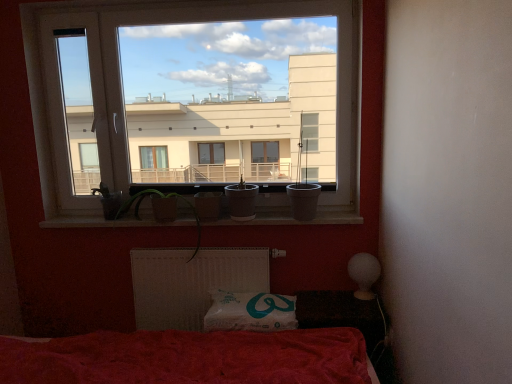
What is the approximate width of transparent glass window at upper center?

It is 3.83 inches.

The image size is (512, 384). What do you see at coordinates (158, 203) in the screenshot?
I see `green matte plant at center` at bounding box center [158, 203].

Describe the element at coordinates (290, 219) in the screenshot. I see `smooth concrete window sill at center` at that location.

Where is `white textured radiator at lower center`? white textured radiator at lower center is located at coordinates (191, 282).

The width and height of the screenshot is (512, 384). What do you see at coordinates (191, 283) in the screenshot?
I see `red fabric bed at lower left` at bounding box center [191, 283].

What do you see at coordinates (250, 312) in the screenshot?
I see `white fabric pillow at lower center` at bounding box center [250, 312].

Identify the location of matte white pot at center. The image size is (512, 384). (241, 200).

Is smooth concrete window sill at center oriented away from transparent glass window at upper center?

smooth concrete window sill at center is not turned away from transparent glass window at upper center.

Is transparent glass window at upper center located within smooth concrete window sill at center?

No, transparent glass window at upper center is not inside smooth concrete window sill at center.

Is smooth concrete window sill at center closer to camera compared to transparent glass window at upper center?

No, it is not.

Which object is wider, smooth concrete window sill at center or transparent glass window at upper center?

With larger width is smooth concrete window sill at center.

Is matte white pot at center in front of or behind smooth concrete window sill at center in the image?

matte white pot at center is positioned closer to the viewer than smooth concrete window sill at center.

From a real-world perspective, between matte white pot at center and smooth concrete window sill at center, who is vertically lower?

smooth concrete window sill at center, from a real-world perspective.

From the image's perspective, which one is positioned higher, matte white pot at center or smooth concrete window sill at center?

matte white pot at center.

Consider the image. Does matte white pot at center turn towards smooth concrete window sill at center?

No, matte white pot at center is not oriented towards smooth concrete window sill at center.

Does matte white pot at center appear on the right side of transparent glass window at upper center?

Correct, you'll find matte white pot at center to the right of transparent glass window at upper center.

Does matte white pot at center have a greater width compared to transparent glass window at upper center?

Yes.

Find the location of a particular element. window above the matte white pot at center (from a real-world perspective) is located at coordinates (194, 99).

Is matte white pot at center positioned far away from transparent glass window at upper center?

Actually, matte white pot at center and transparent glass window at upper center are a little close together.

Are red fabric bed at lower left and green matte plant at center far apart?

No.

Is red fabric bed at lower left facing away from green matte plant at center?

No, red fabric bed at lower left's orientation is not away from green matte plant at center.

Is red fabric bed at lower left not inside green matte plant at center?

Indeed, red fabric bed at lower left is completely outside green matte plant at center.

Is red fabric bed at lower left in front of green matte plant at center?

Yes, the depth of red fabric bed at lower left is less than that of green matte plant at center.

Can you confirm if transparent glass window at upper center is shorter than matte white pot at center?

In fact, transparent glass window at upper center may be taller than matte white pot at center.

Is transparent glass window at upper center wider than matte white pot at center?

No.

In the image, is transparent glass window at upper center positioned in front of or behind matte white pot at center?

Clearly, transparent glass window at upper center is in front of matte white pot at center.

How different are the orientations of transparent glass window at upper center and matte white pot at center in degrees?

transparent glass window at upper center and matte white pot at center are facing 1.37 degrees away from each other.

From the image's perspective, would you say white textured radiator at lower center is positioned over white fabric pillow at lower center?

Yes, from the image's perspective, white textured radiator at lower center is on top of white fabric pillow at lower center.

Which is in front, white textured radiator at lower center or white fabric pillow at lower center?

white fabric pillow at lower center.

Where is `radiator behind the white fabric pillow at lower center`? radiator behind the white fabric pillow at lower center is located at coordinates (191, 282).

Is white textured radiator at lower center inside the boundaries of white fabric pillow at lower center, or outside?

white textured radiator at lower center is not enclosed by white fabric pillow at lower center.

Which of these two, smooth concrete window sill at center or white fabric pillow at lower center, is bigger?

white fabric pillow at lower center.

Is smooth concrete window sill at center taller than white fabric pillow at lower center?

Incorrect, the height of smooth concrete window sill at center is not larger of that of white fabric pillow at lower center.

Does point (210, 225) come closer to viewer compared to point (223, 319)?

No, it is behind (223, 319).

Is smooth concrete window sill at center placed right next to white fabric pillow at lower center?

They are not placed beside each other.

At what (x,y) coordinates should I click in order to perform the action: click on window sill below the transparent glass window at upper center (from a real-world perspective). Please return your answer as a coordinate pair (x, y). This screenshot has width=512, height=384. Looking at the image, I should click on (290, 219).

I want to click on window sill below the matte white pot at center (from the image's perspective), so click(x=290, y=219).

Which object lies further to the anchor point smooth concrete window sill at center, red fabric bed at lower left or green matte plant at center?

red fabric bed at lower left lies further to smooth concrete window sill at center than the other object.

Considering their positions, is white textured radiator at lower center positioned further to smooth concrete window sill at center than green matte plant at center?

white textured radiator at lower center.

Estimate the real-world distances between objects in this image. Which object is closer to green matte plant at center, red fabric bed at lower left or white textured radiator at lower center?

white textured radiator at lower center lies closer to green matte plant at center than the other object.

Based on their spatial positions, is white fabric pillow at lower center or transparent glass window at upper center further from green matte plant at center?

transparent glass window at upper center is positioned further to the anchor green matte plant at center.

Looking at the image, which one is located further to smooth concrete window sill at center, green matte plant at center or white fabric pillow at lower center?

white fabric pillow at lower center is positioned further to the anchor smooth concrete window sill at center.

Which object lies further to the anchor point red fabric bed at lower left, white fabric pillow at lower center or white textured radiator at lower center?

Based on the image, white fabric pillow at lower center appears to be further to red fabric bed at lower left.

From the image, which object appears to be farther from transparent glass window at upper center, white textured radiator at lower center or white fabric pillow at lower center?

The object further to transparent glass window at upper center is white fabric pillow at lower center.

Based on the photo, when comparing their distances from smooth concrete window sill at center, does red fabric bed at lower left or white textured radiator at lower center seem closer?

red fabric bed at lower left is closer to smooth concrete window sill at center.

The image size is (512, 384). In order to click on plant that lies between smooth concrete window sill at center and white fabric pillow at lower center from top to bottom in this screenshot , I will do `click(158, 203)`.

Find the location of a particular element. window sill between transparent glass window at upper center and white textured radiator at lower center in the up-down direction is located at coordinates (290, 219).

Where is `plant between matte white pot at center and white fabric pillow at lower center in the up-down direction`? plant between matte white pot at center and white fabric pillow at lower center in the up-down direction is located at coordinates (158, 203).

This screenshot has height=384, width=512. I want to click on window sill between transparent glass window at upper center and green matte plant at center in the vertical direction, so click(x=290, y=219).